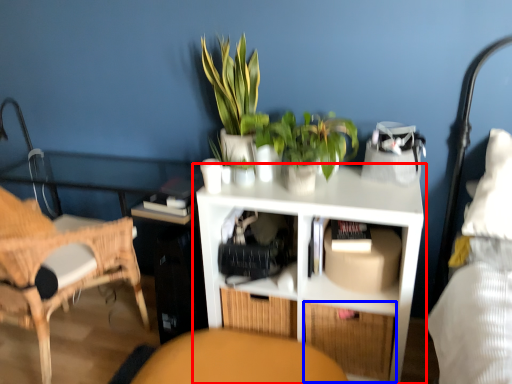
Question: Which object appears closest to the camera in this image, shelf (highlighted by a red box) or drawer (highlighted by a blue box)?

Choices:
 (A) shelf
 (B) drawer

Answer: (A)